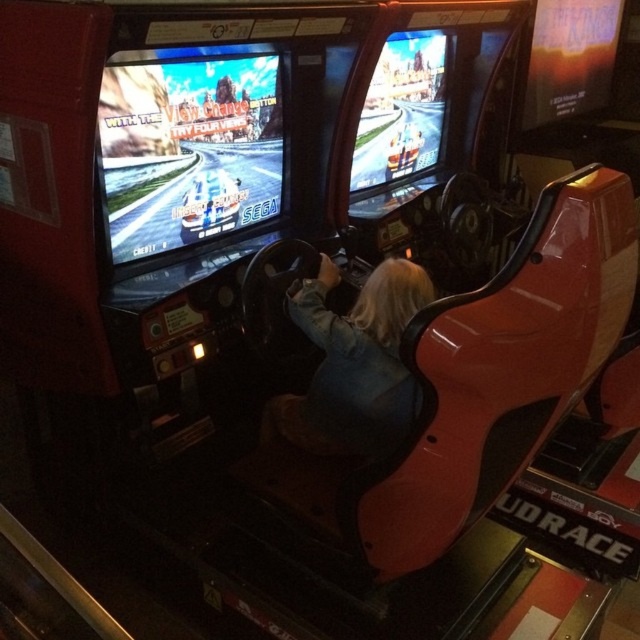
You are a parent trying to take a photo of your child playing the arcade game. The shiny plastic screen at center is reflecting light. To avoid glare, you need to stand at least 5 feet away from the screen. Can you take the photo from where you are standing?

The shiny plastic screen at center is 5.13 feet away from the child, so yes, you can take the photo because the distance is more than 5 feet, which is sufficient to avoid glare.

You are a game developer analyzing the arcade setup. Considering the shiny plastic screen at center and the denim jacket at center, which object is taller?

The shiny plastic screen at center is taller than the denim jacket at center.